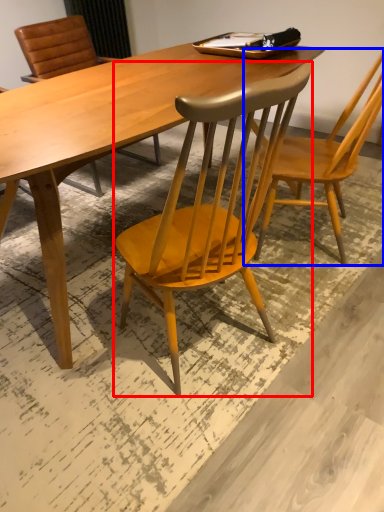
Question: Which point is closer to the camera, chair (highlighted by a red box) or chair (highlighted by a blue box)?

Choices:
 (A) chair
 (B) chair

Answer: (A)